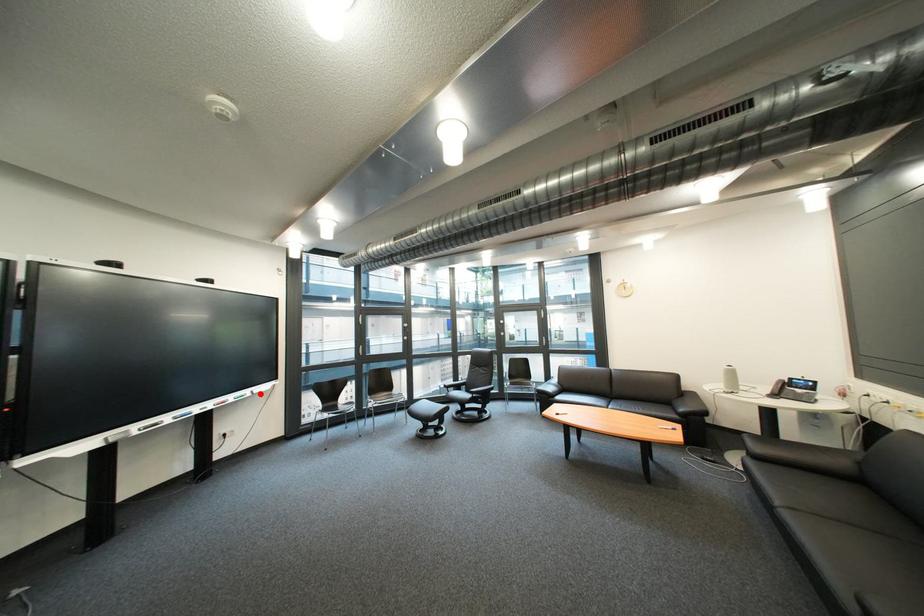
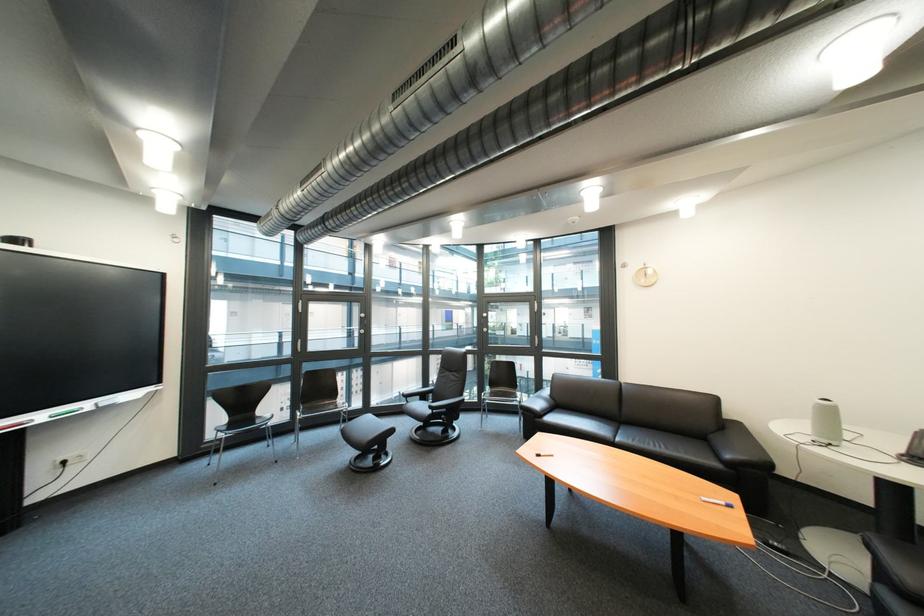
Find the pixel in the second image that matches the highlighted location in the first image.

(101, 406)